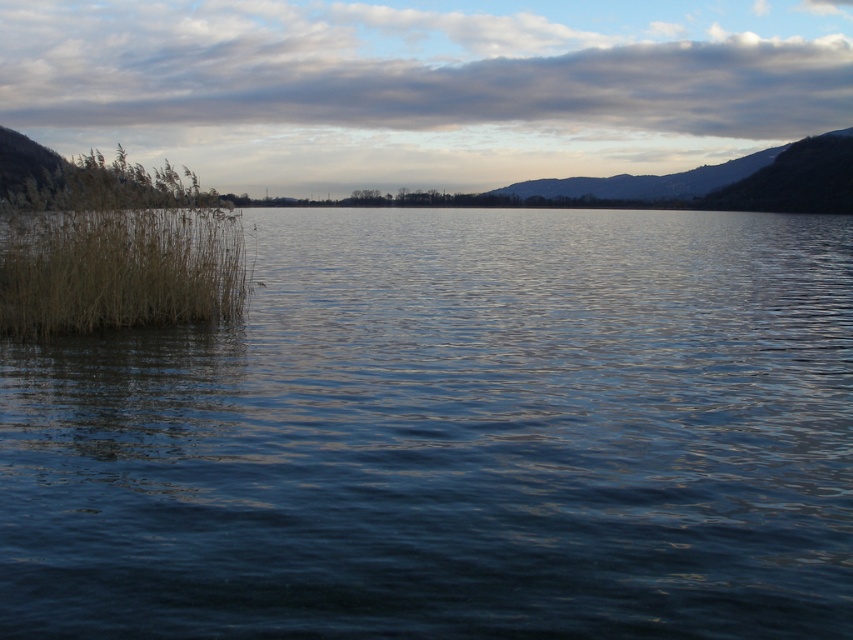
Who is more forward, [785,412] or [634,182]?

Point [785,412] is more forward.

Is dark blue water at left in front of dark brown rocky mountain at upper right?

Yes, dark blue water at left is closer to the viewer.

Describe the element at coordinates (451, 436) in the screenshot. I see `dark blue water at left` at that location.

Where is `dark blue water at left`? This screenshot has width=853, height=640. dark blue water at left is located at coordinates (451, 436).

Is point (152, 298) positioned in front of point (537, 192)?

Yes, point (152, 298) is in front of point (537, 192).

This screenshot has width=853, height=640. Describe the element at coordinates (114, 252) in the screenshot. I see `brown grass at left` at that location.

The image size is (853, 640). What do you see at coordinates (114, 252) in the screenshot?
I see `brown grass at left` at bounding box center [114, 252].

Locate an element on the screen. brown grass at left is located at coordinates (114, 252).

Does dark blue water at left have a greater height compared to brown grass at left?

In fact, dark blue water at left may be shorter than brown grass at left.

Which is behind, point (660, 506) or point (15, 252)?

The point (15, 252) is behind.

I want to click on dark blue water at left, so click(x=451, y=436).